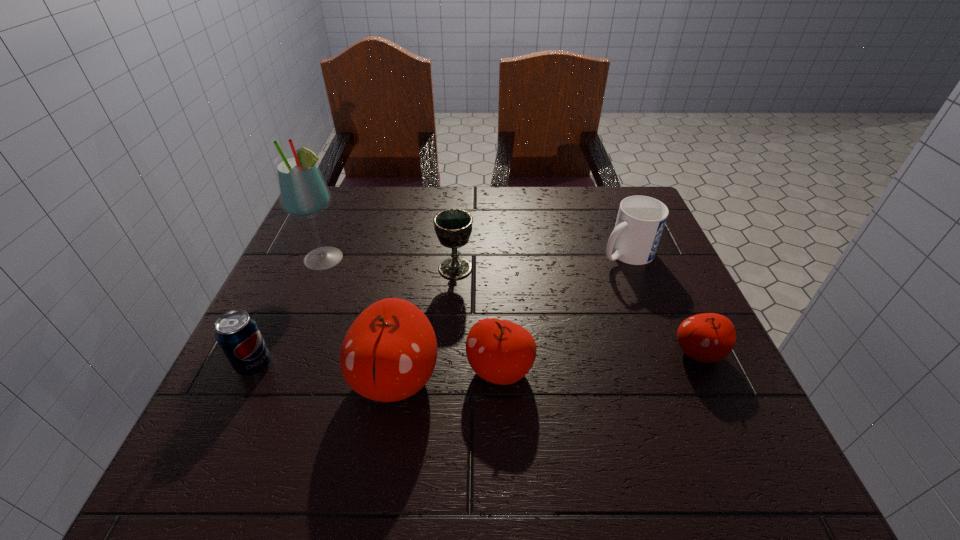
Identify which apple is the nearest to the mug. Please provide its 2D coordinates. Your answer should be formatted as a tuple, i.e. [(x, y)], where the tuple contains the x and y coordinates of a point satisfying the conditions above.

[(709, 337)]

Identify the location of free space that satisfies the following two spatial constraints: 1. on the front side of the shortest object; 2. on the left side of the alcohol. (287, 353).

I want to click on vacant space that satisfies the following two spatial constraints: 1. on the front side of the tallest apple; 2. on the left side of the soda can, so click(x=249, y=379).

Find the location of a particular element. The height and width of the screenshot is (540, 960). vacant space that satisfies the following two spatial constraints: 1. on the front side of the chalice; 2. on the left side of the second shortest apple is located at coordinates (449, 369).

Where is `vacant point that satisfies the following two spatial constraints: 1. on the back side of the chalice; 2. on the right side of the soda can`? vacant point that satisfies the following two spatial constraints: 1. on the back side of the chalice; 2. on the right side of the soda can is located at coordinates (300, 268).

Find the location of a particular element. vacant position in the image that satisfies the following two spatial constraints: 1. on the front side of the chalice; 2. on the right side of the alcohol is located at coordinates (322, 268).

The image size is (960, 540). What are the coordinates of `free space that satisfies the following two spatial constraints: 1. on the front side of the rightmost apple; 2. on the right side of the chalice` in the screenshot? It's located at (450, 353).